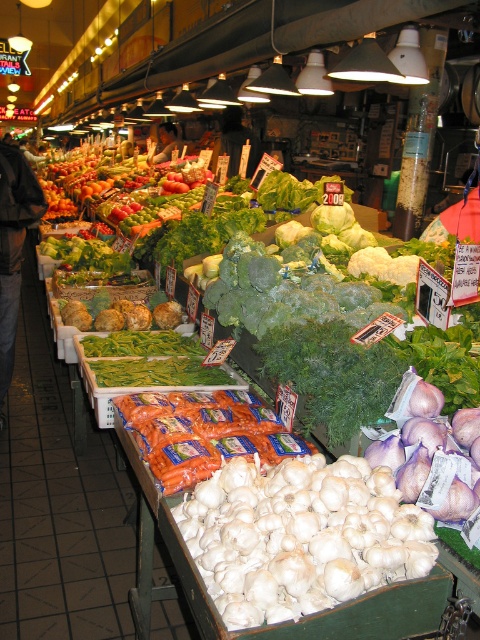
Who is positioned more to the right, orange plastic carrots at center or dark blue jeans at lower left?

orange plastic carrots at center is more to the right.

Does orange plastic carrots at center come in front of dark blue jeans at lower left?

Yes, orange plastic carrots at center is in front of dark blue jeans at lower left.

Locate an element on the screen. orange plastic carrots at center is located at coordinates (203, 433).

Find the location of a particular element. Image resolution: width=480 pixels, height=640 pixels. orange plastic carrots at center is located at coordinates (203, 433).

From the picture: How distant is dark blue jeans at lower left from smooth skin face at center?

dark blue jeans at lower left and smooth skin face at center are 6.47 meters apart from each other.

Does point (13, 268) come farther from viewer compared to point (159, 150)?

No, (13, 268) is in front of (159, 150).

Is point (14, 202) positioned in front of point (162, 140)?

Yes, it is.

Image resolution: width=480 pixels, height=640 pixels. What are the coordinates of `dark blue jeans at lower left` in the screenshot? It's located at (13, 244).

The height and width of the screenshot is (640, 480). Describe the element at coordinates (300, 536) in the screenshot. I see `white matte garlic at lower center` at that location.

Does white matte garlic at lower center have a larger size compared to dark blue jeans at lower left?

No.

Does point (344, 561) come closer to viewer compared to point (14, 150)?

Yes.

I want to click on white matte garlic at lower center, so click(x=300, y=536).